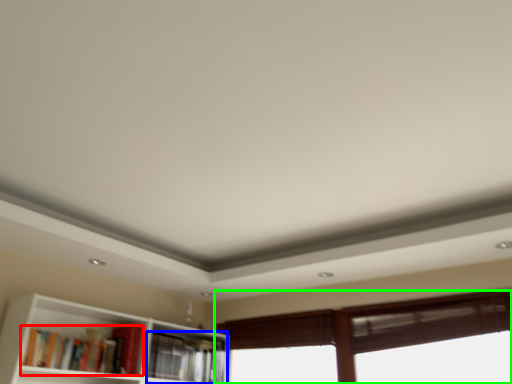
Question: Which object is positioned closest to book (highlighted by a red box)? Select from book (highlighted by a blue box) and window (highlighted by a green box).

Choices:
 (A) book
 (B) window

Answer: (A)